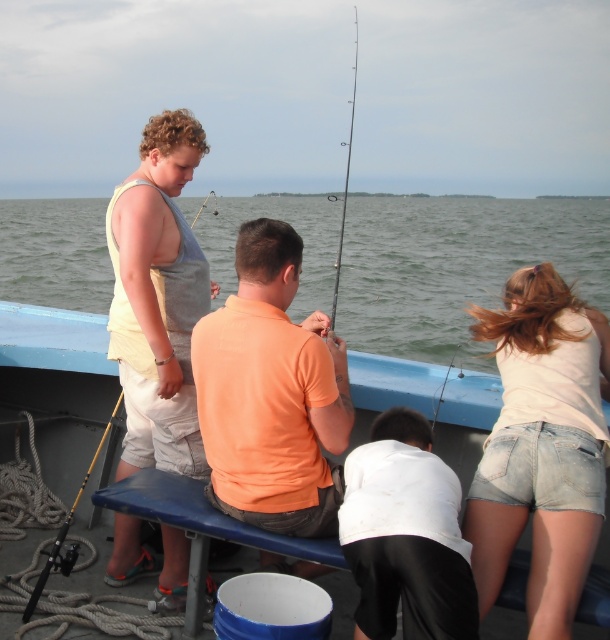
Question: Can you confirm if white denim shorts at lower right is positioned to the right of blue plastic boat at center?

Choices:
 (A) yes
 (B) no

Answer: (A)

Question: Does smooth black rod at center appear under black rod fishing pole at upper center?

Choices:
 (A) no
 (B) yes

Answer: (B)

Question: Which point appears closest to the camera in this image?

Choices:
 (A) pos(118,570)
 (B) pos(420,493)
 (C) pos(41,262)

Answer: (B)

Question: Which point is closer to the camera?

Choices:
 (A) silver metallic fishing pole at center
 (B) matte gray tank top at center

Answer: (B)

Question: Is orange cotton shirt at center closer to the viewer compared to yellow fiberglass fishing pole at lower left?

Choices:
 (A) yes
 (B) no

Answer: (A)

Question: Which point is farther to the camera?

Choices:
 (A) (66, 317)
 (B) (415, 467)

Answer: (A)